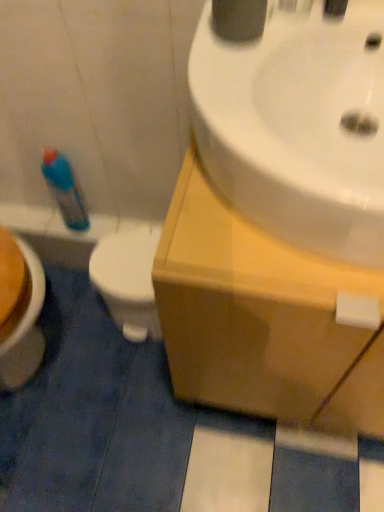
You are a GUI agent. You are given a task and a screenshot of the screen. Output one action in this format:
    pyautogui.click(x=<x>, y=<y>)
    Task: Click on the vacant area on top of white glossy sink at upper right (from a real-world perspective)
    The width and height of the screenshot is (384, 512).
    Given the screenshot: What is the action you would take?
    pyautogui.click(x=250, y=68)